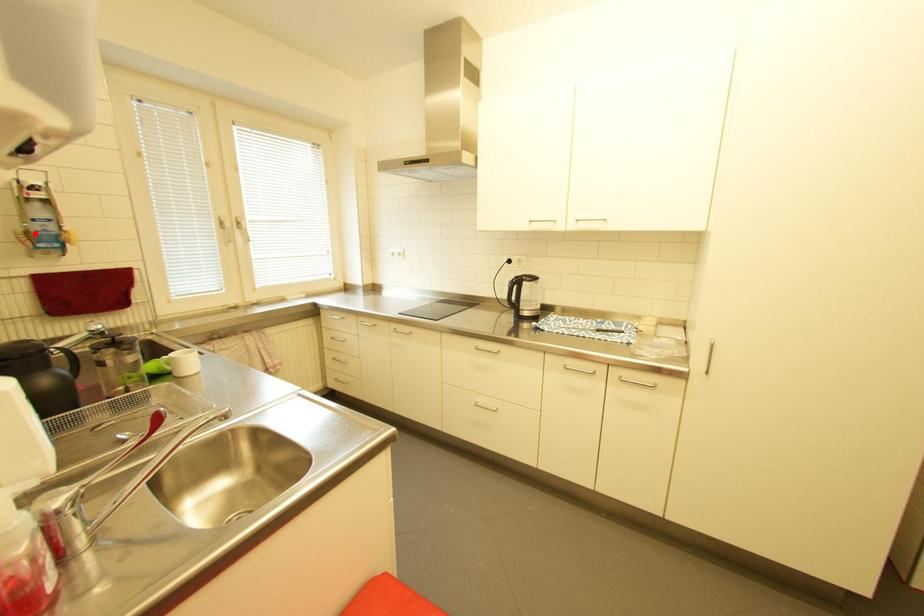
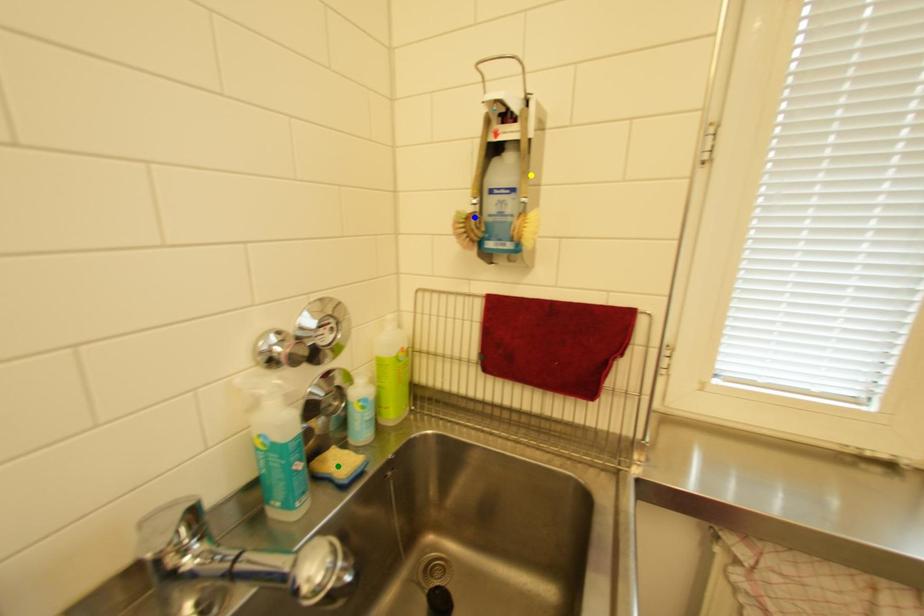
Question: I am providing you with two images of the same scene from different viewpoints. A red point is marked on the first image. You are given multiple points on the second image. Which mark in image 2 goes with the point in image 1?

Choices:
 (A) blue point
 (B) yellow point
 (C) green point

Answer: (A)